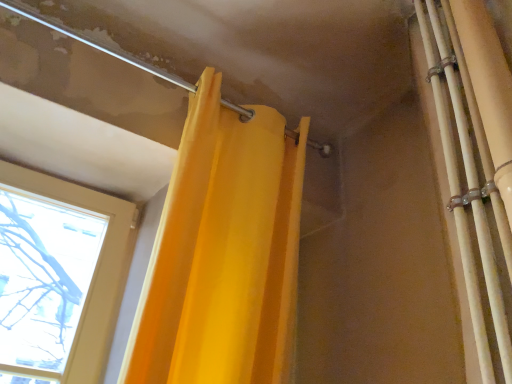
Where is `matte metal pipe at upper left`? The width and height of the screenshot is (512, 384). matte metal pipe at upper left is located at coordinates (96, 44).

Describe the element at coordinates (96, 44) in the screenshot. I see `matte metal pipe at upper left` at that location.

This screenshot has height=384, width=512. What do you see at coordinates (476, 163) in the screenshot?
I see `matte yellow curtain at upper left` at bounding box center [476, 163].

The height and width of the screenshot is (384, 512). Find the location of `matte yellow curtain at upper left`. matte yellow curtain at upper left is located at coordinates (476, 163).

This screenshot has width=512, height=384. In order to click on matte metal pipe at upper left in this screenshot , I will do `click(96, 44)`.

Considering the positions of objects matte yellow curtain at upper left and matte metal pipe at upper left in the image provided, who is more to the left, matte yellow curtain at upper left or matte metal pipe at upper left?

matte metal pipe at upper left.

Is the depth of matte yellow curtain at upper left greater than that of matte metal pipe at upper left?

No, it is in front of matte metal pipe at upper left.

Is point (470, 21) closer or farther from the camera than point (76, 34)?

Point (470, 21) appears to be closer to the viewer than point (76, 34).

Based on the photo, from the image's perspective, is matte yellow curtain at upper left positioned above or below matte metal pipe at upper left?

matte yellow curtain at upper left is below matte metal pipe at upper left.

From a real-world perspective, which object stands above the other?

matte metal pipe at upper left, from a real-world perspective.

Does matte yellow curtain at upper left have a lesser width compared to matte metal pipe at upper left?

Yes.

Between matte yellow curtain at upper left and matte metal pipe at upper left, which one has more height?

With more height is matte yellow curtain at upper left.

In terms of size, does matte yellow curtain at upper left appear bigger or smaller than matte metal pipe at upper left?

In the image, matte yellow curtain at upper left appears to be larger than matte metal pipe at upper left.

Choose the correct answer: Is matte yellow curtain at upper left inside matte metal pipe at upper left or outside it?

matte yellow curtain at upper left is located beyond the bounds of matte metal pipe at upper left.

Are matte yellow curtain at upper left and matte metal pipe at upper left beside each other?

No, matte yellow curtain at upper left is not making contact with matte metal pipe at upper left.

Is matte yellow curtain at upper left oriented towards matte metal pipe at upper left?

No, matte yellow curtain at upper left is not oriented towards matte metal pipe at upper left.

How many degrees apart are the facing directions of matte yellow curtain at upper left and matte metal pipe at upper left?

The facing directions of matte yellow curtain at upper left and matte metal pipe at upper left are 91.4 degrees apart.

How far apart are matte yellow curtain at upper left and matte metal pipe at upper left?

matte yellow curtain at upper left is 29.63 inches from matte metal pipe at upper left.

Find the location of a particular element. This screenshot has width=512, height=384. pipe that is above the matte yellow curtain at upper left (from a real-world perspective) is located at coordinates (96, 44).

Between matte metal pipe at upper left and matte yellow curtain at upper left, which one appears on the left side from the viewer's perspective?

matte metal pipe at upper left.

Is matte metal pipe at upper left behind matte yellow curtain at upper left?

That is True.

Which is in front, point (314, 143) or point (474, 288)?

Positioned in front is point (474, 288).

From the image's perspective, between matte metal pipe at upper left and matte yellow curtain at upper left, which one is located above?

matte metal pipe at upper left.

From a real-world perspective, is matte metal pipe at upper left on matte yellow curtain at upper left?

Yes, from a real-world perspective, matte metal pipe at upper left is above matte yellow curtain at upper left.

Which object is thinner, matte metal pipe at upper left or matte yellow curtain at upper left?

With smaller width is matte yellow curtain at upper left.

Considering the relative sizes of matte metal pipe at upper left and matte yellow curtain at upper left in the image provided, is matte metal pipe at upper left shorter than matte yellow curtain at upper left?

Yes, matte metal pipe at upper left is shorter than matte yellow curtain at upper left.

From the picture: Is matte metal pipe at upper left bigger than matte yellow curtain at upper left?

No, matte metal pipe at upper left is not bigger than matte yellow curtain at upper left.

Is matte metal pipe at upper left not inside matte yellow curtain at upper left?

matte metal pipe at upper left is positioned outside matte yellow curtain at upper left.

Consider the image. Is matte metal pipe at upper left next to matte yellow curtain at upper left and touching it?

No, matte metal pipe at upper left is not touching matte yellow curtain at upper left.

From the picture: Is matte metal pipe at upper left facing away from matte yellow curtain at upper left?

matte metal pipe at upper left does not have its back to matte yellow curtain at upper left.

How many degrees apart are the facing directions of matte metal pipe at upper left and matte yellow curtain at upper left?

matte metal pipe at upper left and matte yellow curtain at upper left are facing 91.4 degrees away from each other.

Where is `shower curtain in front of the matte metal pipe at upper left`? The height and width of the screenshot is (384, 512). shower curtain in front of the matte metal pipe at upper left is located at coordinates (476, 163).

Where is `shower curtain below the matte metal pipe at upper left (from a real-world perspective)`? The image size is (512, 384). shower curtain below the matte metal pipe at upper left (from a real-world perspective) is located at coordinates (476, 163).

Identify the location of shower curtain in front of the matte metal pipe at upper left. The width and height of the screenshot is (512, 384). (476, 163).